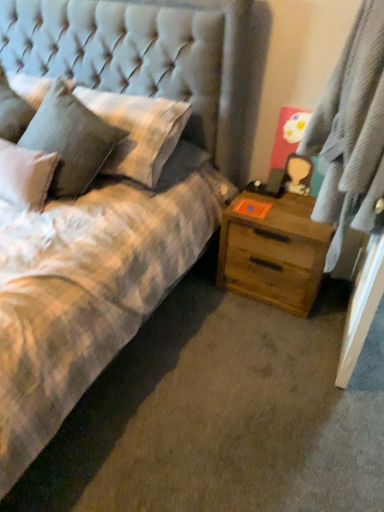
Question: Considering the relative positions of gray textured curtain at right and tufted fabric headboard at upper left in the image provided, is gray textured curtain at right to the left or to the right of tufted fabric headboard at upper left?

Choices:
 (A) right
 (B) left

Answer: (A)

Question: Is gray textured curtain at right in front of or behind tufted fabric headboard at upper left in the image?

Choices:
 (A) front
 (B) behind

Answer: (A)

Question: Which of these objects is positioned farthest from the textured gray pillow at upper left, the 1th pillow viewed from the right?

Choices:
 (A) gray textured curtain at right
 (B) fluffy white pillow at upper left, acting as the second pillow starting from the right
 (C) tufted fabric headboard at upper left
 (D) wooden nightstand at right

Answer: (A)

Question: Which object is the closest to the fluffy white pillow at upper left, acting as the second pillow starting from the right?

Choices:
 (A) gray textured curtain at right
 (B) wooden nightstand at right
 (C) tufted fabric headboard at upper left
 (D) textured gray pillow at upper left, placed as the 2th pillow when sorted from left to right

Answer: (D)